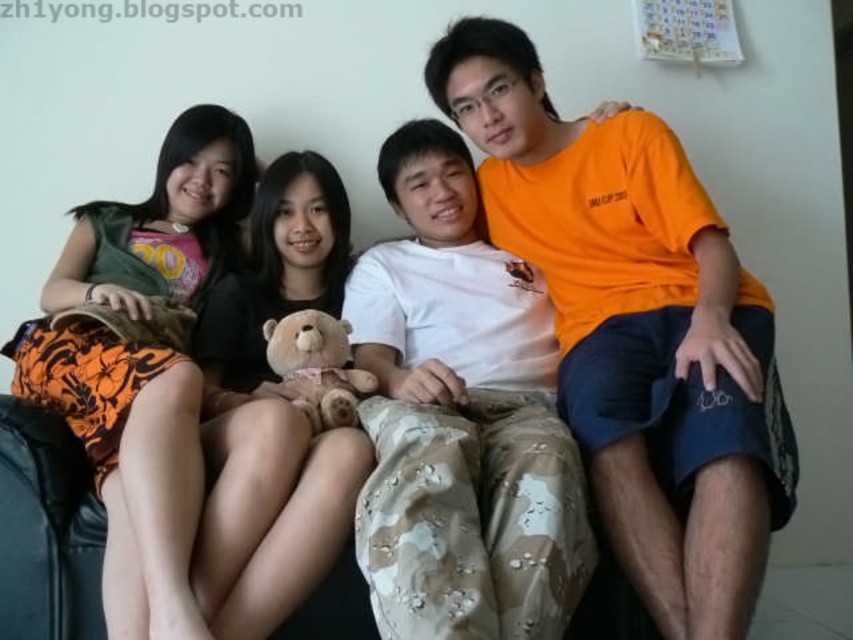
Is point (670, 321) farther from camera compared to point (312, 196)?

No, it is not.

Does orange cotton t-shirt at center lie behind soft brown teddy bear at center?

No, orange cotton t-shirt at center is in front of soft brown teddy bear at center.

Find the location of a particular element. Image resolution: width=853 pixels, height=640 pixels. orange cotton t-shirt at center is located at coordinates (636, 330).

The width and height of the screenshot is (853, 640). I want to click on orange cotton t-shirt at center, so click(x=636, y=330).

Does point (631, 157) come closer to viewer compared to point (335, 394)?

No.

Is orange cotton t-shirt at center bigger than soft brown plush at center?

Indeed, orange cotton t-shirt at center has a larger size compared to soft brown plush at center.

Is point (599, 509) closer to viewer compared to point (271, 365)?

Yes, it is.

I want to click on orange cotton t-shirt at center, so click(636, 330).

Can you confirm if soft brown teddy bear at center is positioned below soft brown plush at center?

Correct, soft brown teddy bear at center is located below soft brown plush at center.

Does soft brown teddy bear at center lie behind soft brown plush at center?

No, soft brown teddy bear at center is in front of soft brown plush at center.

Where is `soft brown teddy bear at center`? This screenshot has width=853, height=640. soft brown teddy bear at center is located at coordinates (271, 412).

This screenshot has height=640, width=853. Find the location of `soft brown teddy bear at center`. soft brown teddy bear at center is located at coordinates (271, 412).